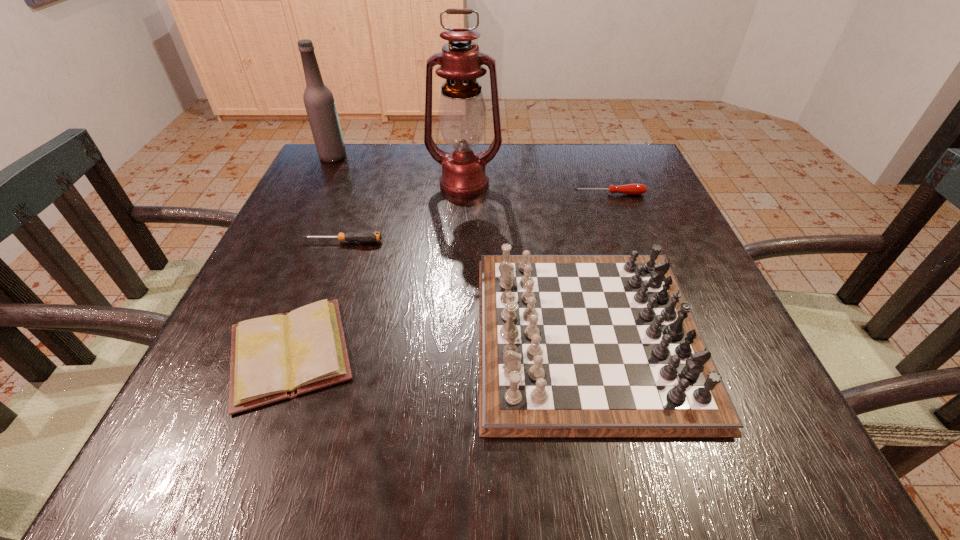
Locate an element on the screen. This screenshot has height=540, width=960. blank area in the image that satisfies the following two spatial constraints: 1. on the side of the beer bottle with the label; 2. on the right side of the diary is located at coordinates [239, 353].

I want to click on vacant region that satisfies the following two spatial constraints: 1. on the side of the nearer screwdriver with the label; 2. on the right side of the beer bottle, so click(292, 242).

Identify the location of free space that satisfies the following two spatial constraints: 1. on the side of the fifth shortest object with the label; 2. on the right side of the diary. This screenshot has height=540, width=960. coord(239,353).